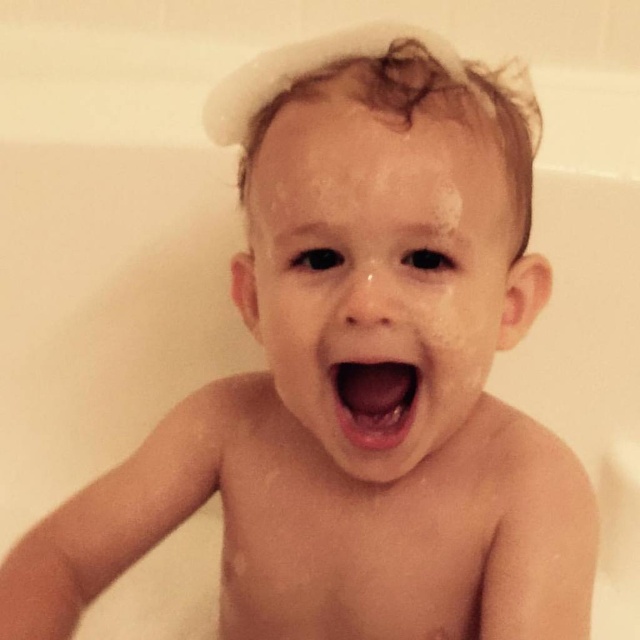
You are a photographer taking a picture of the child in the bathtub. You have two points marked in the scene, point A at coordinates point (396, 212) and point B at coordinates point (353, 419). Which point should you focus on to ensure the child is in focus?

Point A at coordinates point (396, 212) is closer to the viewer than point B at coordinates point (353, 419). Therefore, focusing on point A will ensure the child is in focus.

Based on the scene description, if you were to draw a vertical line through the center of the image, which object would be located above the other between the wet skin face at center and the pink glossy lips at center?

The wet skin face at center is positioned over the pink glossy lips at center, so the wet skin face would be above the pink glossy lips when drawing a vertical line through the center of the image.

You are a photographer taking a closeup shot of a child in a bathtub. You need to focus on the wet skin face at center and the pink glossy lips at center. Which object should you adjust your camera focus to first if the lips are your main subject?

The wet skin face at center is to the left of pink glossy lips at center, so you should focus on the pink glossy lips at center first as they are the main subject.